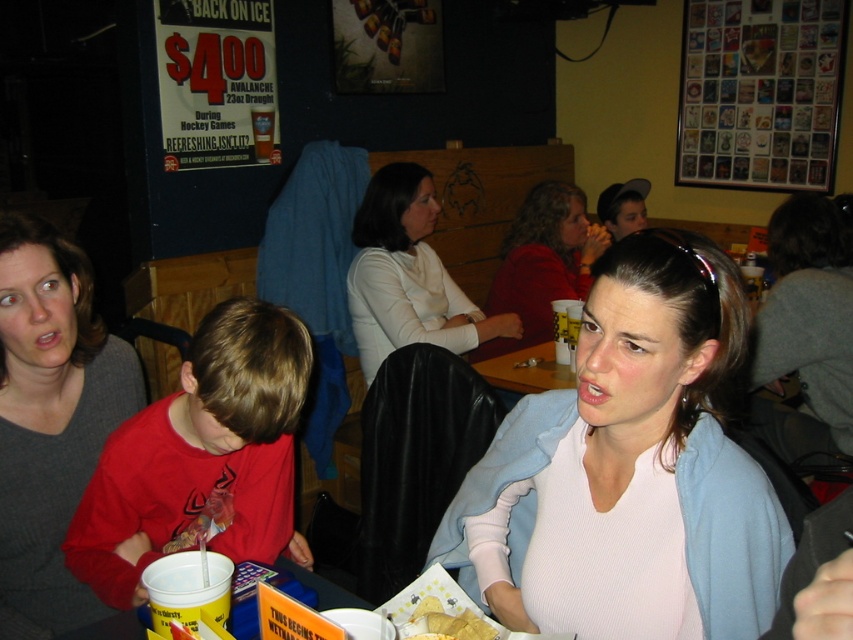
Question: Can you confirm if white ribbed sweater at center is smaller than yellow crispy chips at lower center?

Choices:
 (A) yes
 (B) no

Answer: (B)

Question: Does wooden table at center lie behind yellow crispy chips at lower center?

Choices:
 (A) yes
 (B) no

Answer: (A)

Question: Which of the following is the closest to the observer?

Choices:
 (A) (416, 236)
 (B) (582, 296)
 (C) (271, 524)

Answer: (C)

Question: Which object is farther from the camera taking this photo?

Choices:
 (A) gray knit sweater at upper left
 (B) yellow crispy chips at lower center

Answer: (A)

Question: Does gray knit sweater at upper left appear on the left side of white matte shirt at center?

Choices:
 (A) yes
 (B) no

Answer: (A)

Question: Which point is closer to the camera taking this photo?

Choices:
 (A) (33, 554)
 (B) (103, 548)
 (C) (527, 356)
 (D) (418, 604)

Answer: (D)